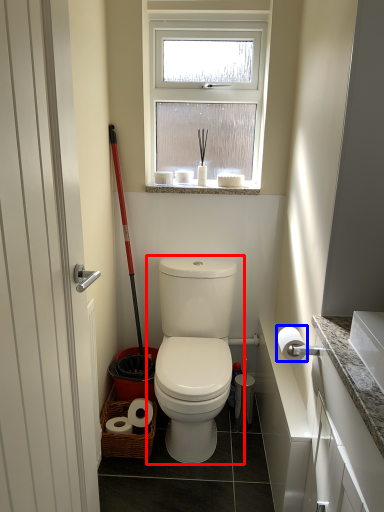
Question: Among these objects, which one is nearest to the camera, toilet (highlighted by a red box) or toilet paper (highlighted by a blue box)?

Choices:
 (A) toilet
 (B) toilet paper

Answer: (B)